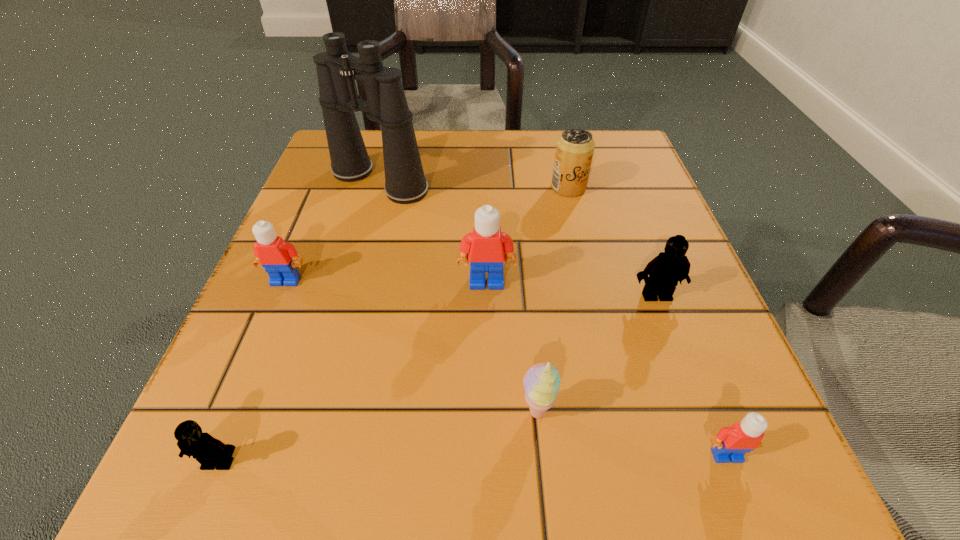
Find the location of a particular element. The image size is (960, 540). free space at the far left corner is located at coordinates (384, 160).

In the image, there is a desktop. Where is `vacant space at the near right corner`? The height and width of the screenshot is (540, 960). vacant space at the near right corner is located at coordinates (695, 511).

Locate an element on the screen. Image resolution: width=960 pixels, height=540 pixels. free space between the smallest white Lego and the farther black Lego is located at coordinates (691, 375).

Image resolution: width=960 pixels, height=540 pixels. I want to click on free space between the leftmost white Lego and the seventh shortest object, so click(x=386, y=281).

In order to click on vacant area between the right black Lego and the nearest white Lego in this screenshot , I will do `click(691, 375)`.

Image resolution: width=960 pixels, height=540 pixels. In order to click on free spot between the third object from right to left and the nearer black Lego in this screenshot , I will do `click(394, 325)`.

Locate an element on the screen. The image size is (960, 540). vacant space that is in between the sixth object from left to right and the rightmost white Lego is located at coordinates (647, 321).

Where is `empty location between the binoculars and the nearest white Lego`? This screenshot has width=960, height=540. empty location between the binoculars and the nearest white Lego is located at coordinates (553, 318).

The image size is (960, 540). Identify the location of free space between the tallest object and the tallest Lego. (433, 232).

Image resolution: width=960 pixels, height=540 pixels. I want to click on free space between the smallest white Lego and the third object from right to left, so click(647, 321).